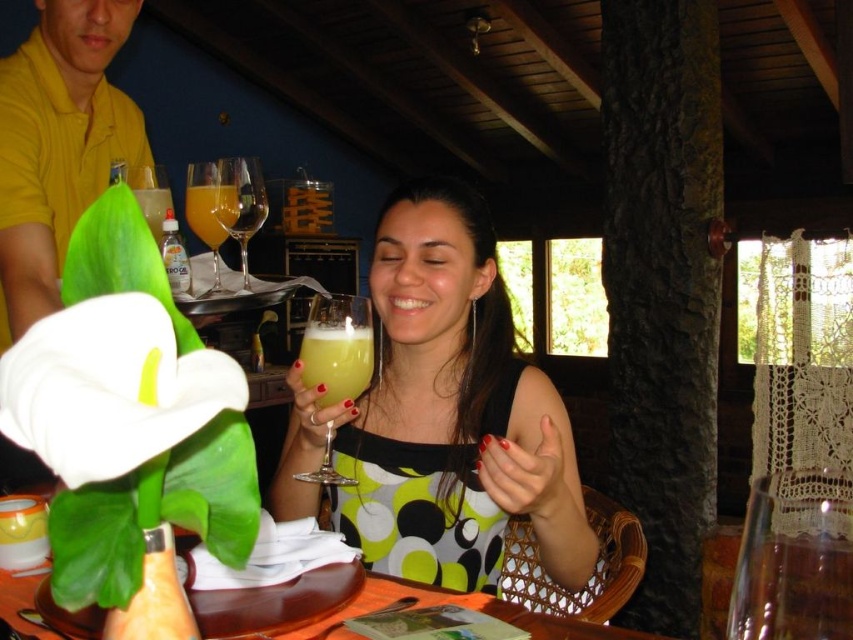
You are standing in the rustic restaurant scene and want to place a new decorative item on the orange wood table at lower center. According to the scene description, where exactly should you place it?

The orange wood table at lower center should have the new decorative item placed at its 2D location coordinates of point (444, 600).

From the picture: You are a waiter in a busy restaurant and need to quickly grab the translucent glass at upper left without knocking over the translucent glass at upper center. Given their positions, is it possible to reach the one behind without disturbing the one in front?

The translucent glass at upper left is behind the translucent glass at upper center, so it is possible to carefully reach around or behind the front glass to retrieve the one behind without disturbing it.

You are a bartender preparing a drink for a customer. You have a translucent yellow liquid at center and a transparent glass wine glass at upper center. Which container can hold more liquid based on their widths?

The translucent yellow liquid at center has a larger width than the transparent glass wine glass at upper center, so it can hold more liquid.